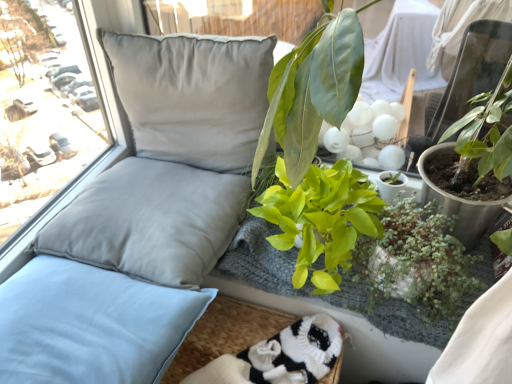
Find the location of a particular element. This screenshot has width=512, height=384. vacant region above light blue fabric pillow at left, placed as the first pillow when sorted from bottom to top (from a real-world perspective) is located at coordinates (69, 321).